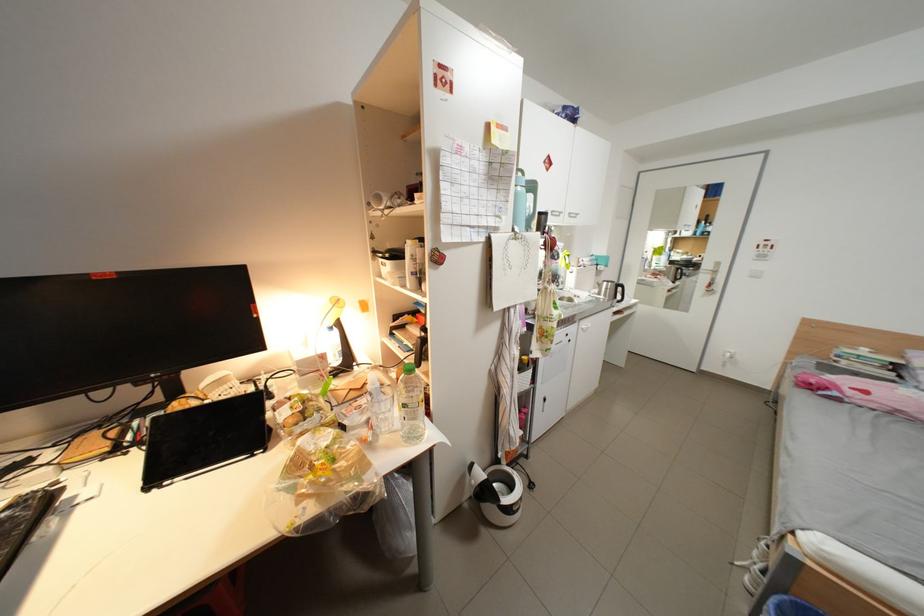
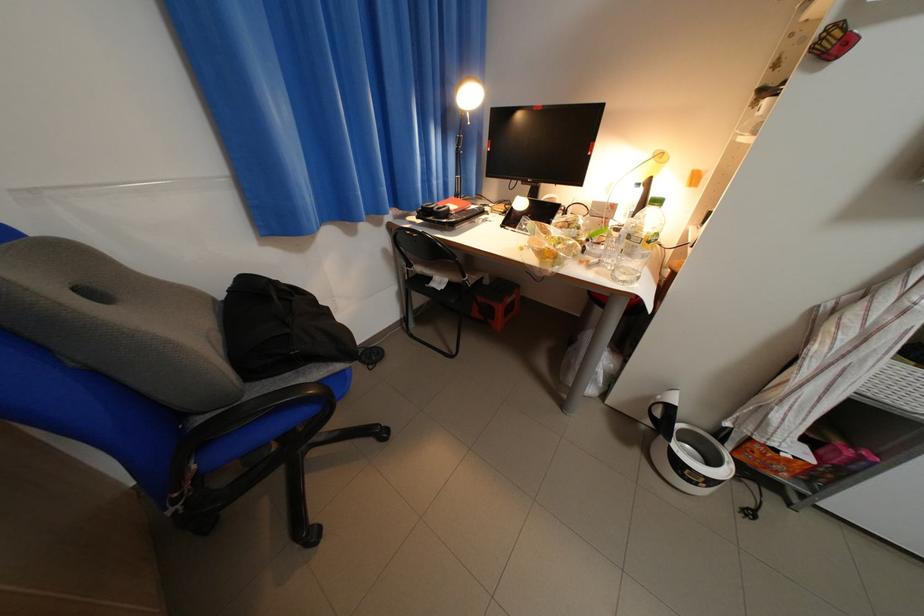
The images are taken continuously from a first-person perspective. In which direction is your viewpoint rotating?

The rotation direction of the camera is left-down.